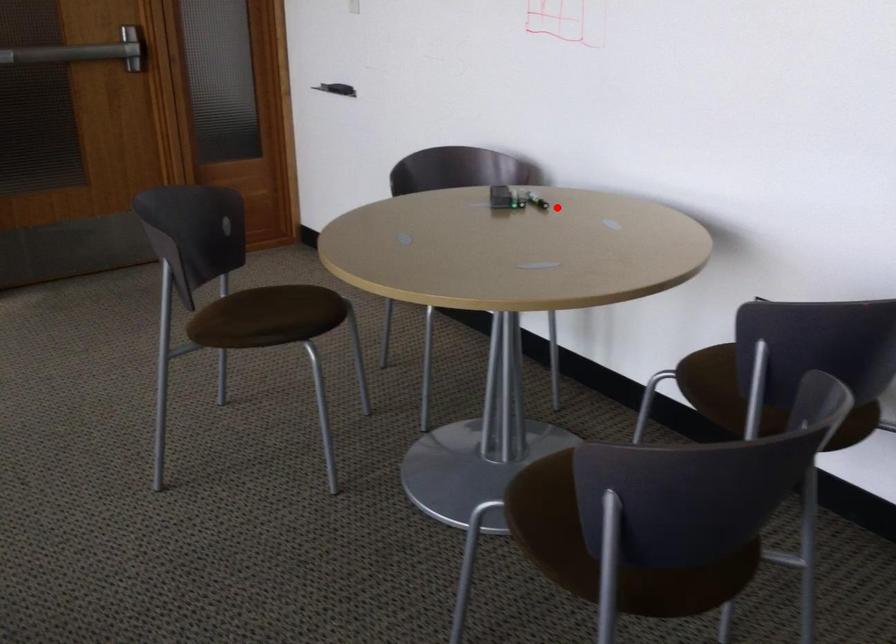
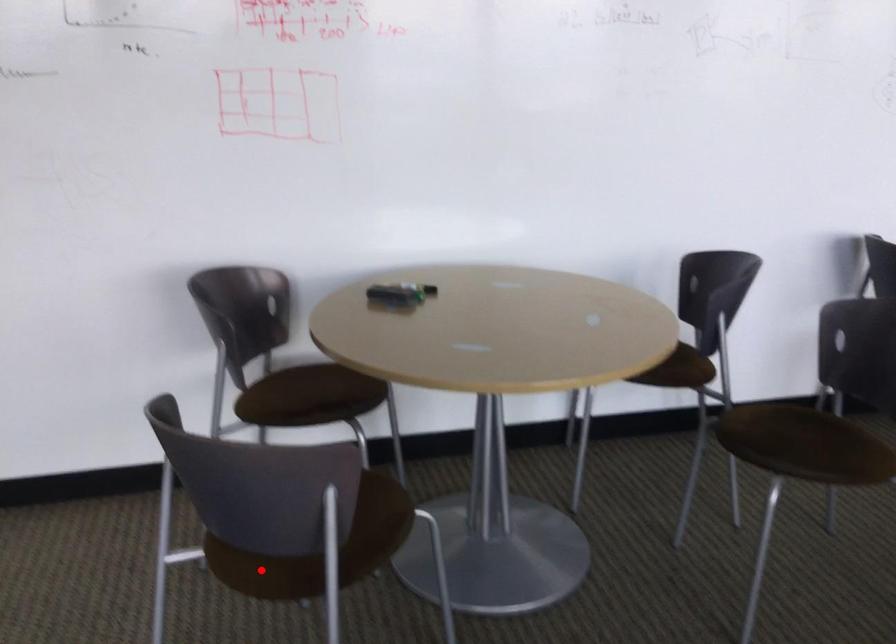
I am providing you with two images of the same scene from different viewpoints. A red point is marked on the first image and another point is marked on the second image. Do the highlighted points in image1 and image2 indicate the same real-world spot?

No